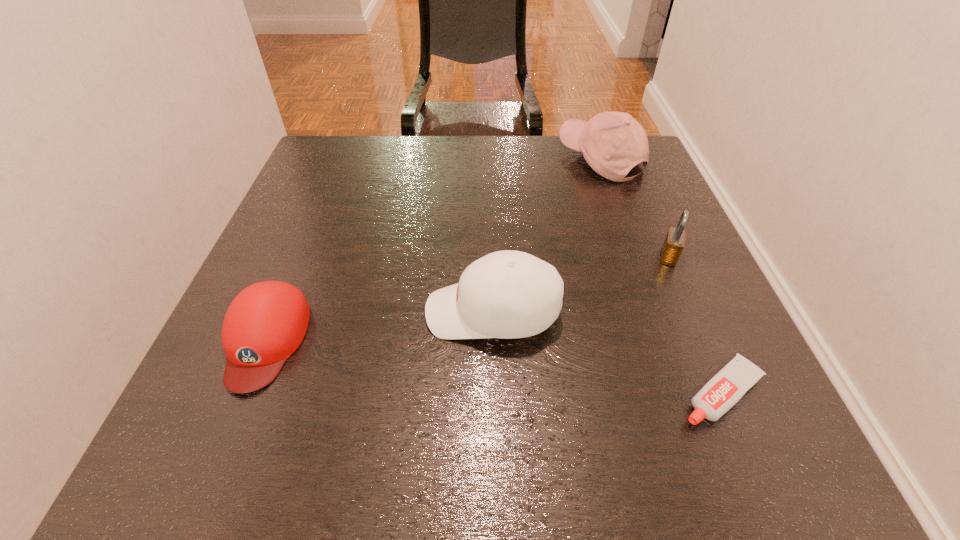
Find the location of a particular element. The image size is (960, 540). free space that satisfies the following two spatial constraints: 1. on the front-facing side of the toothpaste; 2. on the left side of the rightmost baseball cap is located at coordinates (684, 393).

What are the coordinates of `free location that satisfies the following two spatial constraints: 1. on the front-facing side of the second baseball cap from right to left; 2. on the front-facing side of the shortest baseball cap` in the screenshot? It's located at (493, 340).